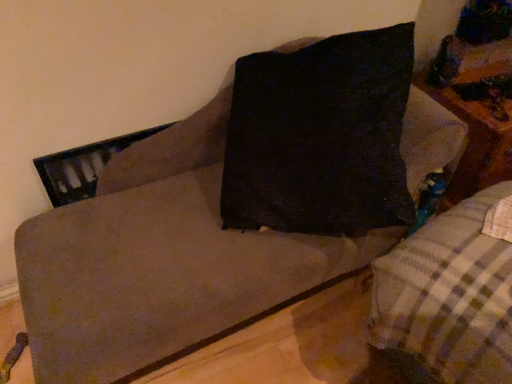
Locate an element on the screen. This screenshot has width=512, height=384. wooden table at right is located at coordinates (474, 141).

What do you see at coordinates (474, 141) in the screenshot? This screenshot has height=384, width=512. I see `wooden table at right` at bounding box center [474, 141].

Measure the distance between point [424,86] and camera.

Point [424,86] is 1.55 meters away from camera.

Describe the element at coordinates (451, 292) in the screenshot. The height and width of the screenshot is (384, 512). I see `plaid fabric couch at center` at that location.

Where is `plaid fabric couch at center`? This screenshot has height=384, width=512. plaid fabric couch at center is located at coordinates (451, 292).

Locate an element on the screen. The image size is (512, 384). wooden table at right is located at coordinates (474, 141).

Which is more to the right, plaid fabric couch at center or wooden table at right?

From the viewer's perspective, wooden table at right appears more on the right side.

Who is more distant, plaid fabric couch at center or wooden table at right?

wooden table at right is further from the camera.

Considering the positions of point (475, 355) and point (465, 198), is point (475, 355) closer or farther from the camera than point (465, 198)?

Point (475, 355) is positioned closer to the camera compared to point (465, 198).

From the image's perspective, which is above, plaid fabric couch at center or wooden table at right?

wooden table at right, from the image's perspective.

From a real-world perspective, who is located higher, plaid fabric couch at center or wooden table at right?

wooden table at right.

Which object is wider, plaid fabric couch at center or wooden table at right?

plaid fabric couch at center is wider.

Is plaid fabric couch at center taller or shorter than wooden table at right?

plaid fabric couch at center is taller than wooden table at right.

In terms of size, does plaid fabric couch at center appear bigger or smaller than wooden table at right?

plaid fabric couch at center is bigger than wooden table at right.

Would you say plaid fabric couch at center is outside wooden table at right?

Yes, plaid fabric couch at center is not within wooden table at right.

Is plaid fabric couch at center with wooden table at right?

No.

Is plaid fabric couch at center oriented towards wooden table at right?

No, plaid fabric couch at center is not aimed at wooden table at right.

From the picture: How different are the orientations of plaid fabric couch at center and wooden table at right in degrees?

The angular difference between plaid fabric couch at center and wooden table at right is 82.5 degrees.

What are the coordinates of `studio couch located in front of the wooden table at right` in the screenshot? It's located at (451, 292).

Does wooden table at right appear on the left side of plaid fabric couch at center?

In fact, wooden table at right is to the right of plaid fabric couch at center.

Which object is closer to the camera taking this photo, wooden table at right or plaid fabric couch at center?

plaid fabric couch at center is closer to the camera.

Is point (496, 179) positioned in front of point (456, 284)?

No, it is behind (456, 284).

From the image's perspective, between wooden table at right and plaid fabric couch at center, which one is located above?

wooden table at right is shown above in the image.

From a real-world perspective, between wooden table at right and plaid fabric couch at center, who is vertically lower?

From a 3D spatial view, plaid fabric couch at center is below.

Which of these two, wooden table at right or plaid fabric couch at center, is thinner?

wooden table at right is thinner.

Can you confirm if wooden table at right is taller than plaid fabric couch at center?

No.

Is wooden table at right bigger than plaid fabric couch at center?

Incorrect, wooden table at right is not larger than plaid fabric couch at center.

Is wooden table at right completely or partially outside of plaid fabric couch at center?

Indeed, wooden table at right is completely outside plaid fabric couch at center.

Is wooden table at right far from plaid fabric couch at center?

No, wooden table at right is in close proximity to plaid fabric couch at center.

Is wooden table at right turned away from plaid fabric couch at center?

No, plaid fabric couch at center is not at the back of wooden table at right.

How different are the orientations of wooden table at right and plaid fabric couch at center in degrees?

82.5 degrees separate the facing orientations of wooden table at right and plaid fabric couch at center.

This screenshot has width=512, height=384. I want to click on studio couch that is below the wooden table at right (from the image's perspective), so click(451, 292).

Image resolution: width=512 pixels, height=384 pixels. Find the location of `studio couch that appears on the left of wooden table at right`. studio couch that appears on the left of wooden table at right is located at coordinates (451, 292).

At what (x,y) coordinates should I click in order to perform the action: click on studio couch below the wooden table at right (from the image's perspective). Please return your answer as a coordinate pair (x, y). Looking at the image, I should click on (451, 292).